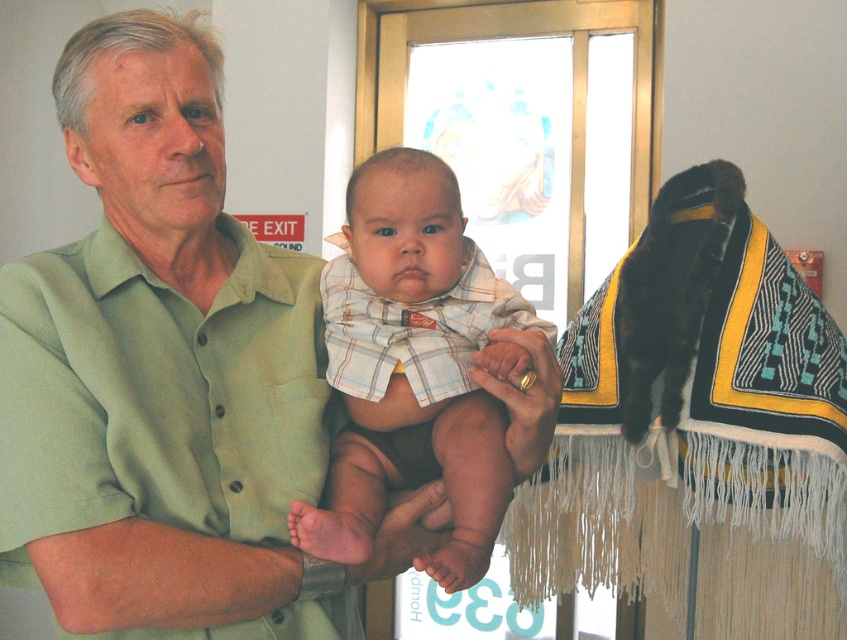
You are standing in the room and want to place a small plant pot on the floor near the black woven blanket at upper right. Based on the image, can you determine the approximate 2D coordinates where you should place the pot?

The black woven blanket at upper right is located at coordinates approximately 0.670 on the x axis and 0.824 on the y axis. To place the plant pot near it, you should aim for coordinates close to these values.

You are an interior designer planning to place a decorative pillow on the green cotton shirt at center. Since the shirt has limited space, will the pillow fit if the pillow requires the same amount of space as the black woven blanket at upper right?

The green cotton shirt at center has a lesser width compared to black woven blanket at upper right. Therefore, the pillow requiring the same space as the blanket won

You are a photographer setting up for a photo shoot. You have a camera with a focal length of 50mm. The black woven blanket at upper right is 73.71 centimeters away from the plaid fabric baby at center. To ensure both objects are in focus, what is the minimum distance you should set the hyperfocal distance? Assume the acceptable circle of confusion is 0.02 mm and the aperture is f8.

The hyperfocal distance can be calculated using the formula H 1.22 x f x f N C, where f is focal length, N is aperture, and C is circle of confusion. Plugging in the values H 1.22 x 50 x 50 8 x 0.02 1.22 x 2500 0.16 3050 0.16 19062.5 mm or approximately 19 meters. However since the distance between the two subjects is only 73.71 cm, you can focus at the plaid fabric baby at center and ensure the hyperfocal distance is set to 19 meters to have both the black woven blanket at upper right and the plad